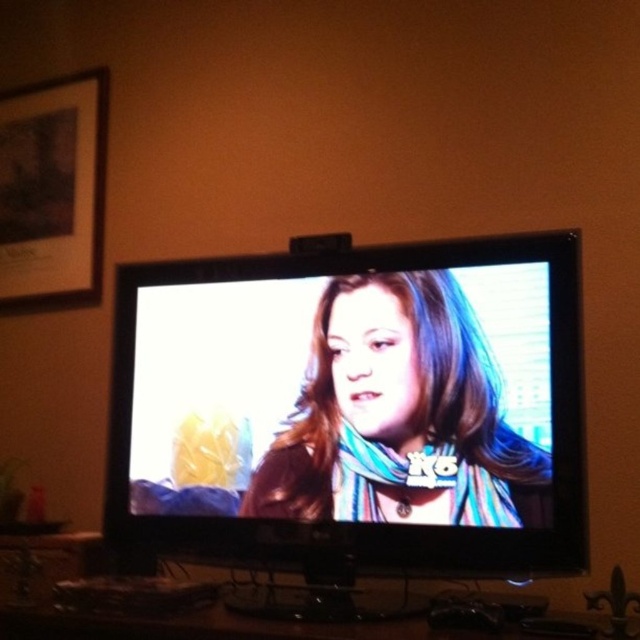
You are trying to decide whether to place a new rectangular box that is 1 meter wide on the wooden surface below the TV. The wooden surface is currently holding the matte brown leather jacket at center and the wooden framed picture at upper left. Based on their sizes, can the box fit on the surface without overlapping them?

The matte brown leather jacket at center is wider than the wooden framed picture at upper left. However, since the box is 1 meter wide and we don not have exact measurements of the objects or the surface, it is uncertain if the box will fit without overlapping. Consider rearranging items or checking the available space.